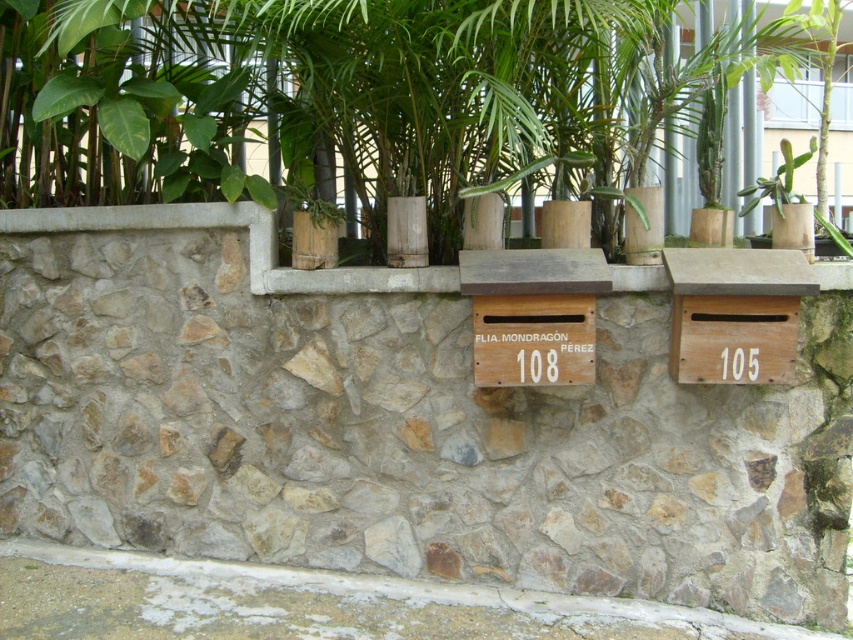
Is point (200, 595) farther from camera compared to point (751, 195)?

No, it is in front of (751, 195).

Is white stone ledge at lower center to the left of green succulent at center from the viewer's perspective?

Indeed, white stone ledge at lower center is positioned on the left side of green succulent at center.

The width and height of the screenshot is (853, 640). What do you see at coordinates (312, 604) in the screenshot?
I see `white stone ledge at lower center` at bounding box center [312, 604].

The width and height of the screenshot is (853, 640). I want to click on white stone ledge at lower center, so click(x=312, y=604).

Based on the photo, which is more to the right, smooth concrete ledge at center or green succulent at center?

green succulent at center is more to the right.

Is point (376, 269) positioned before point (793, 196)?

No, it is behind (793, 196).

Locate an element on the screen. smooth concrete ledge at center is located at coordinates (248, 244).

Is natural stone mailbox at center further to the viewer compared to green succulent at center?

That is True.

Does natural stone mailbox at center appear over green succulent at center?

Incorrect, natural stone mailbox at center is not positioned above green succulent at center.

Is point (227, 518) farther from viewer compared to point (779, 204)?

That is True.

Where is `natural stone mailbox at center`? natural stone mailbox at center is located at coordinates (399, 422).